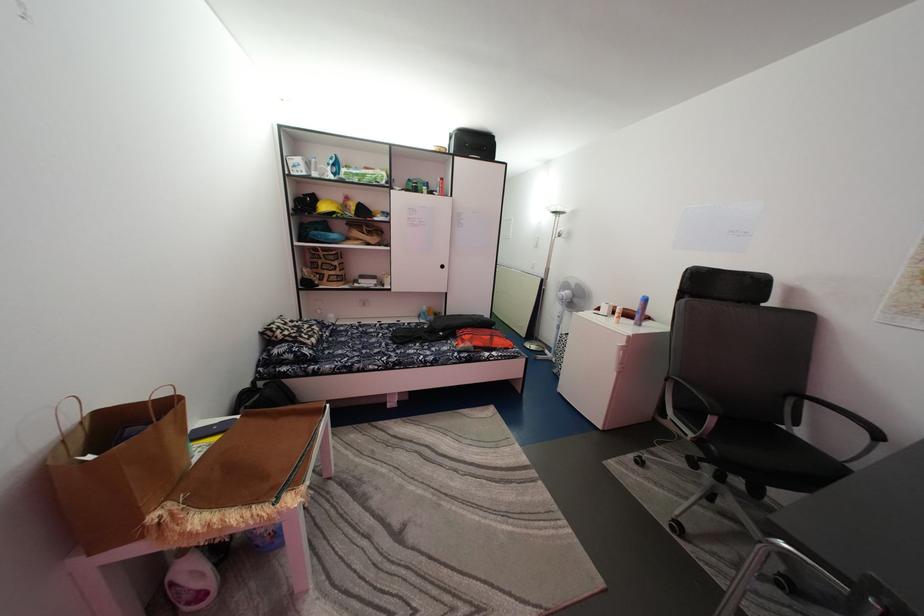
The height and width of the screenshot is (616, 924). What do you see at coordinates (640, 310) in the screenshot? I see `the blue spray can` at bounding box center [640, 310].